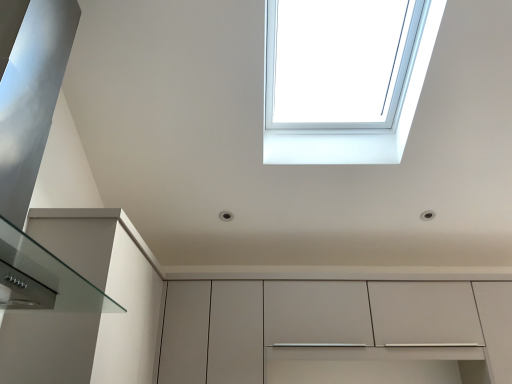
Question: From the image's perspective, is transparent glass window at upper center above matte white cabinet at center?

Choices:
 (A) yes
 (B) no

Answer: (A)

Question: Considering the relative sizes of transparent glass window at upper center and matte white cabinet at center in the image provided, is transparent glass window at upper center wider than matte white cabinet at center?

Choices:
 (A) yes
 (B) no

Answer: (A)

Question: Is transparent glass window at upper center facing away from matte white cabinet at center?

Choices:
 (A) yes
 (B) no

Answer: (B)

Question: Is transparent glass window at upper center not close to matte white cabinet at center?

Choices:
 (A) no
 (B) yes

Answer: (A)

Question: Considering the relative sizes of transparent glass window at upper center and matte white cabinet at center in the image provided, is transparent glass window at upper center shorter than matte white cabinet at center?

Choices:
 (A) no
 (B) yes

Answer: (B)

Question: Does transparent glass window at upper center turn towards matte white cabinet at center?

Choices:
 (A) no
 (B) yes

Answer: (A)

Question: Does matte white cabinet at center appear on the right side of transparent glass window at upper center?

Choices:
 (A) no
 (B) yes

Answer: (B)

Question: Considering the relative sizes of matte white cabinet at center and transparent glass window at upper center in the image provided, is matte white cabinet at center thinner than transparent glass window at upper center?

Choices:
 (A) yes
 (B) no

Answer: (A)

Question: Is matte white cabinet at center facing away from transparent glass window at upper center?

Choices:
 (A) no
 (B) yes

Answer: (A)

Question: Is matte white cabinet at center smaller than transparent glass window at upper center?

Choices:
 (A) no
 (B) yes

Answer: (A)

Question: Could transparent glass window at upper center be considered to be inside matte white cabinet at center?

Choices:
 (A) yes
 (B) no

Answer: (B)

Question: From the image's perspective, does matte white cabinet at center appear lower than transparent glass window at upper center?

Choices:
 (A) no
 (B) yes

Answer: (B)

Question: Based on their positions, is transparent glass window at upper center located to the left or right of matte white cabinet at center?

Choices:
 (A) left
 (B) right

Answer: (A)